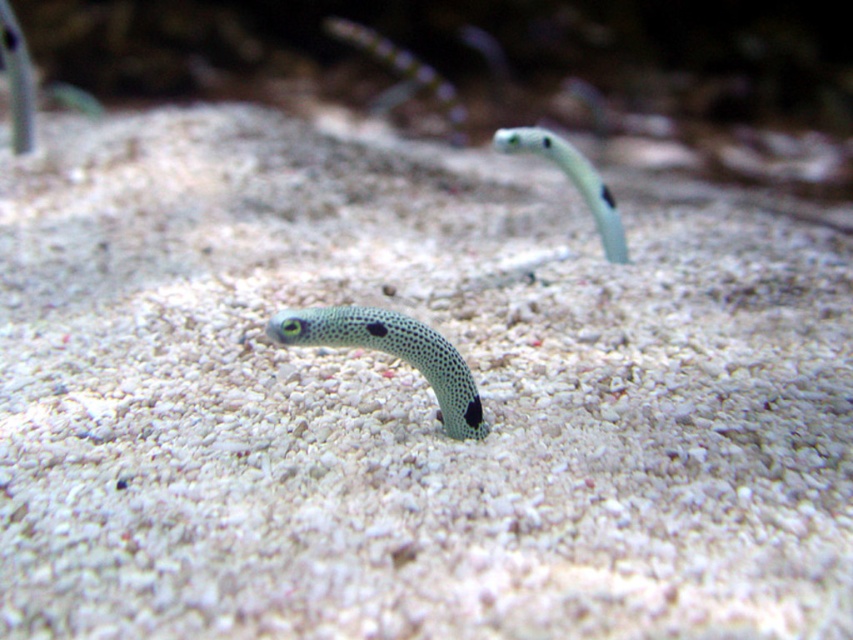
You are a marine biologist observing an aquarium and notice the speckled green snake at center. Can you determine its exact coordinates in the image?

The speckled green snake at center is located at coordinates point (x=392, y=355).

You are an aquarium maintenance worker who needs to clean the tank. You see the speckled green snake at center and the green spotted snake at center. Which snake would be easier to maneuver around during cleaning?

The speckled green snake at center occupies less space than the green spotted snake at center, so it would be easier to maneuver around during cleaning.

You are an aquarium maintenance worker who needs to clean the tank. The speckled green snake at center and the green spotted snake at center are both in the way of your cleaning path. Can you safely move your cleaning tool between them without touching either?

The distance between the speckled green snake at center and the green spotted snake at center is 24.59 inches, so yes, you can safely move your cleaning tool between them without touching either since the space is sufficient.